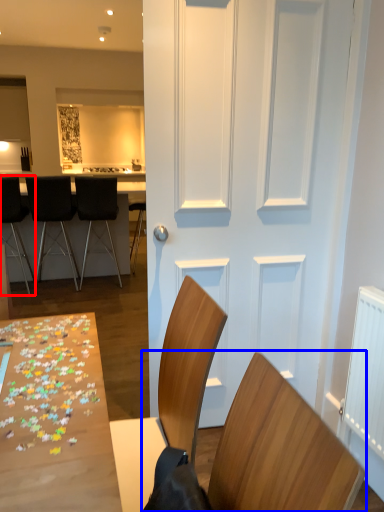
Question: Which point is closer to the camera, chair (highlighted by a red box) or chair (highlighted by a blue box)?

Choices:
 (A) chair
 (B) chair

Answer: (B)